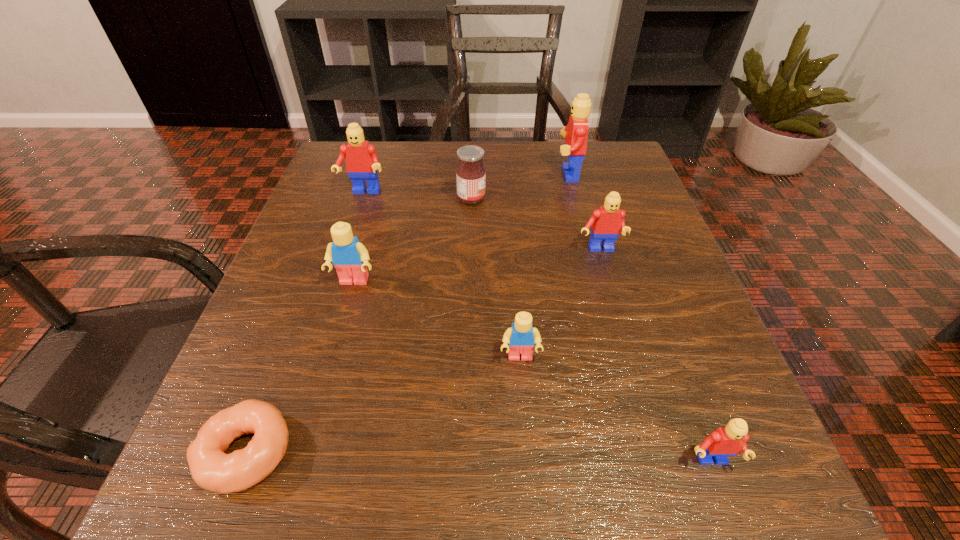
The height and width of the screenshot is (540, 960). Identify the location of free space located on the front-facing side of the third biggest red Lego. (608, 281).

Identify the location of vacant space located 0.210m on the label side of the jam. Image resolution: width=960 pixels, height=540 pixels. (586, 199).

This screenshot has width=960, height=540. What are the coordinates of `vacant space located on the front-facing side of the smaller yellow Lego` in the screenshot? It's located at (528, 464).

Image resolution: width=960 pixels, height=540 pixels. I want to click on vacant space located 0.380m on the back of the tan doughnut, so click(330, 231).

Find the location of a particular element. The height and width of the screenshot is (540, 960). jam present at the far edge is located at coordinates (470, 173).

Where is `Lego positioned at the near edge`? This screenshot has height=540, width=960. Lego positioned at the near edge is located at coordinates (730, 440).

Where is `doughnut situated at the near edge`? doughnut situated at the near edge is located at coordinates (211, 468).

Where is `doughnut that is at the left edge`? doughnut that is at the left edge is located at coordinates (211, 468).

Identify the location of object at the far left corner. (362, 163).

Image resolution: width=960 pixels, height=540 pixels. What are the coordinates of `object that is at the near left corner` in the screenshot? It's located at (211, 468).